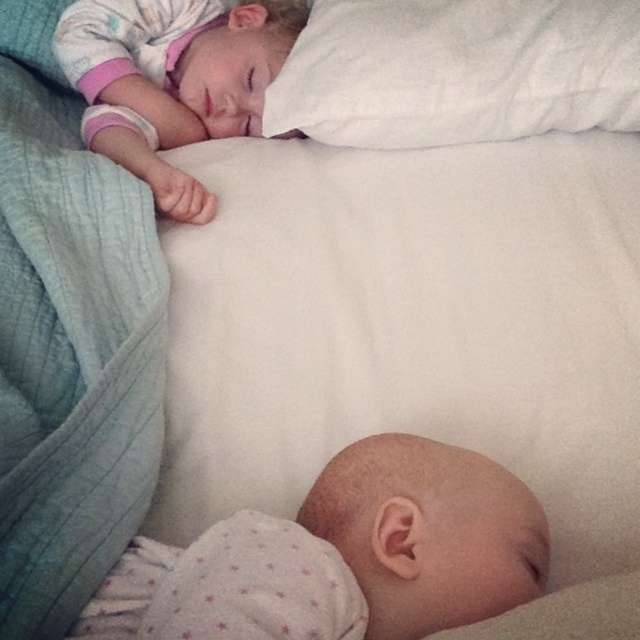
Question: Which object appears farthest from the camera in this image?

Choices:
 (A) matte white pillow at upper center
 (B) white soft pillow at upper center

Answer: (B)

Question: Estimate the real-world distances between objects in this image. Which object is closer to the matte white pillow at upper center?

Choices:
 (A) white soft baby at upper left
 (B) teal quilted blanket at left
 (C) white soft pillow at upper center

Answer: (B)

Question: Is white soft baby at upper left to the right of white soft pillow at upper center from the viewer's perspective?

Choices:
 (A) yes
 (B) no

Answer: (B)

Question: Estimate the real-world distances between objects in this image. Which object is closer to the matte white pillow at upper center?

Choices:
 (A) white soft baby at upper left
 (B) teal quilted blanket at left
 (C) white soft pillow at upper center

Answer: (B)

Question: Does white soft baby at upper left have a greater width compared to white soft pillow at upper center?

Choices:
 (A) yes
 (B) no

Answer: (B)

Question: Is white soft baby at upper left positioned at the back of matte white pillow at upper center?

Choices:
 (A) no
 (B) yes

Answer: (A)